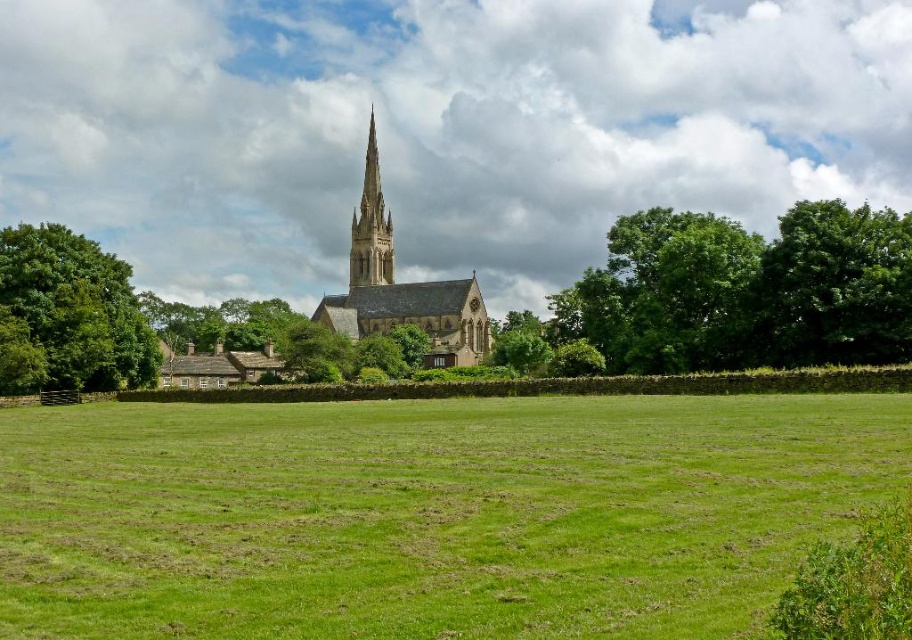
Who is more distant from viewer, (828,362) or (6,244)?

Point (6,244)

Is point (681, 308) positioned in front of point (9, 358)?

No, (681, 308) is further to viewer.

Who is more distant from viewer, (506, 324) or (125, 262)?

The point (506, 324) is more distant.

Locate an element on the screen. The height and width of the screenshot is (640, 912). green leafy tree at center is located at coordinates (744, 291).

Who is lower down, green leafy tree at center or smooth stone spire at center?

Positioned lower is green leafy tree at center.

Between green leafy tree at center and smooth stone spire at center, which one has less height?

green leafy tree at center is shorter.

Is point (714, 330) closer to camera compared to point (368, 204)?

Yes.

You are a GUI agent. You are given a task and a screenshot of the screen. Output one action in this format:
    pyautogui.click(x=<x>, y=<y>)
    Task: Click on the green leafy tree at center
    This screenshot has height=640, width=912.
    Given the screenshot: What is the action you would take?
    pyautogui.click(x=744, y=291)

Image resolution: width=912 pixels, height=640 pixels. Find the location of `green grass at center`. green grass at center is located at coordinates (430, 515).

Is point (596, 566) positioned before point (804, 294)?

Yes, it is.

This screenshot has height=640, width=912. I want to click on green grass at center, so click(430, 515).